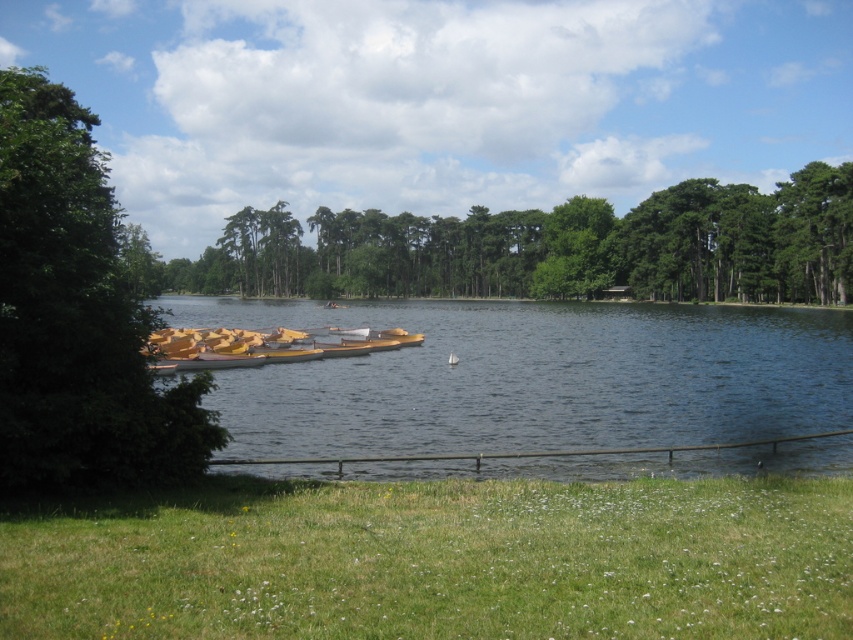
Does point (548, 394) come closer to viewer compared to point (59, 360)?

No, (548, 394) is behind (59, 360).

Between point (218, 392) and point (80, 289), which one is positioned in front?

Positioned in front is point (80, 289).

Which is in front, point (581, 392) or point (50, 358)?

Point (50, 358) is in front.

I want to click on clear blue water at center, so click(544, 385).

Is the position of green grass at lower center less distant than that of yellow wood boats at center?

Yes.

Between green grass at lower center and yellow wood boats at center, which one has less height?

Standing shorter between the two is green grass at lower center.

Who is more forward, (672, 563) or (206, 342)?

Positioned in front is point (672, 563).

The height and width of the screenshot is (640, 853). I want to click on green grass at lower center, so click(x=434, y=561).

Is green grass at lower center to the left of clear blue water at center from the viewer's perspective?

Correct, you'll find green grass at lower center to the left of clear blue water at center.

Is green grass at lower center positioned behind clear blue water at center?

No.

What do you see at coordinates (434, 561) in the screenshot? The image size is (853, 640). I see `green grass at lower center` at bounding box center [434, 561].

You are a GUI agent. You are given a task and a screenshot of the screen. Output one action in this format:
    pyautogui.click(x=<x>, y=<y>)
    Task: Click on the green grass at lower center
    This screenshot has width=853, height=640.
    Given the screenshot: What is the action you would take?
    pyautogui.click(x=434, y=561)